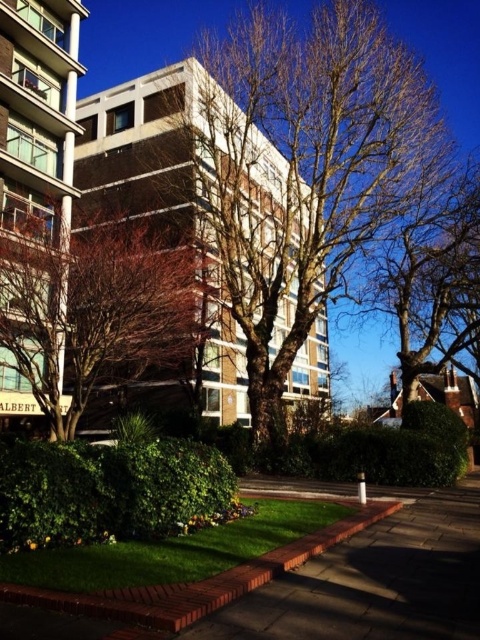
Question: Is brown textured tree at center below bare branches at center?

Choices:
 (A) no
 (B) yes

Answer: (A)

Question: Observing the image, what is the correct spatial positioning of brown textured tree at center in reference to paved stone pavement at center?

Choices:
 (A) below
 (B) above

Answer: (B)

Question: Which point appears farthest from the camera in this image?

Choices:
 (A) (476, 296)
 (B) (317, 49)
 (C) (87, 499)

Answer: (A)

Question: Which point is closer to the camera taking this photo?

Choices:
 (A) (294, 484)
 (B) (320, 42)

Answer: (A)

Question: Is brown textured tree at center to the left of bare branches at upper right from the viewer's perspective?

Choices:
 (A) yes
 (B) no

Answer: (A)

Question: Which point appears closest to the camera in this image?

Choices:
 (A) (56, 456)
 (B) (254, 189)
 (C) (367, 294)
 (D) (326, 593)

Answer: (D)